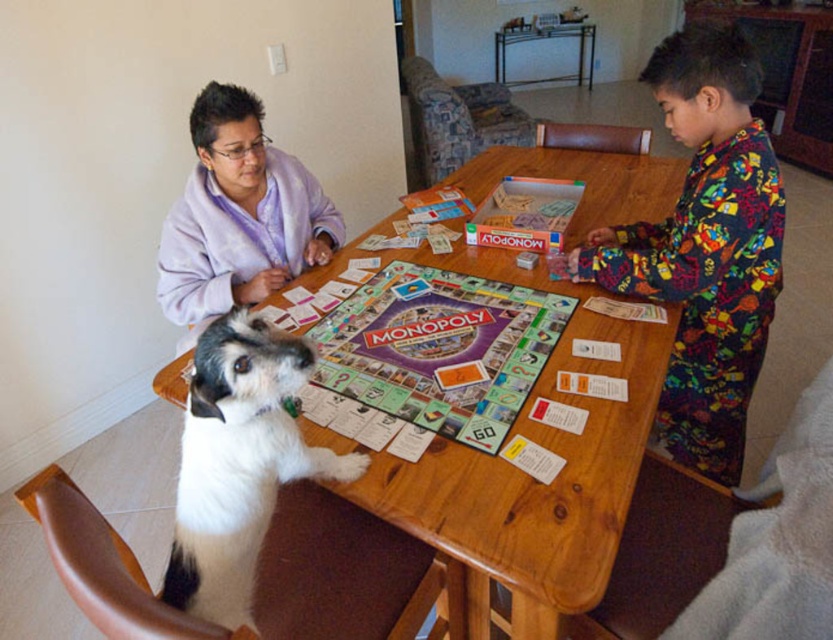
From the picture: You are standing at the point marked as point (691, 166) and want to reach the dining table where the game is being played. Can you comfortably walk to the table without needing to move any objects?

The distance between you and the dining table is 5.10 feet, which is a comfortable walking distance. You can reach the table without needing to move any objects.

You are standing at the center of the dining table and want to pass a game piece to the person in the multicolored pajamas at right. In which direction should you move to reach them?

The multicolored pajamas at right is located at point 0.386 on the x and 0.846 on the y axis, so you should move to the right and slightly forward to reach them.

You are organizing a game night and need to ensure there is enough space for all participants. Given the scene described, can the wooden table at center accommodate the multicolored pajamas at right comfortably?

A: The wooden table at center is larger in size than multicolored pajamas at right, so it can accommodate the multicolored pajamas at right comfortably.